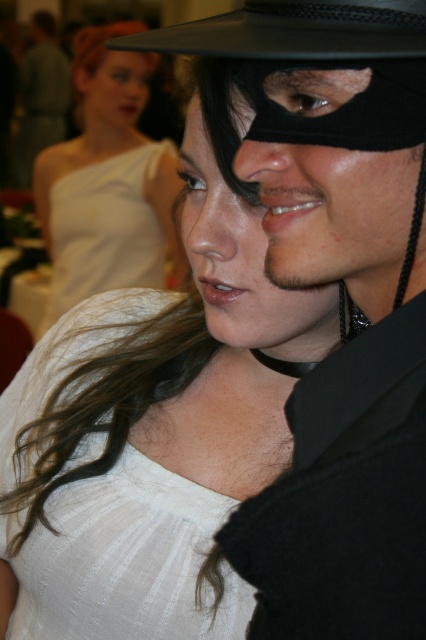
In order to click on black matte fedora at upper center in this screenshot , I will do `click(296, 32)`.

Measure the distance between black matte fedora at upper center and camera.

The distance of black matte fedora at upper center from camera is 13.06 inches.

Looking at this image, who is more distant from viewer, (236,54) or (88,128)?

The point (88,128) is behind.

Find the location of a particular element. The image size is (426, 640). black matte fedora at upper center is located at coordinates (296, 32).

In the scene shown: Which of these two, matte black mask at center or blonde hair at upper left, stands shorter?

Standing shorter between the two is matte black mask at center.

This screenshot has height=640, width=426. Identify the location of matte black mask at center. (242, 262).

This screenshot has height=640, width=426. Describe the element at coordinates (242, 262) in the screenshot. I see `matte black mask at center` at that location.

Identify the location of matte black mask at center. (242, 262).

Which is above, black matte mask at upper right or black matte fedora at upper center?

black matte fedora at upper center is above.

Who is taller, black matte mask at upper right or black matte fedora at upper center?

Standing taller between the two is black matte mask at upper right.

Who is more forward, (367, 259) or (383, 8)?

Point (383, 8) is in front.

Identify the location of black matte mask at upper right. (334, 214).